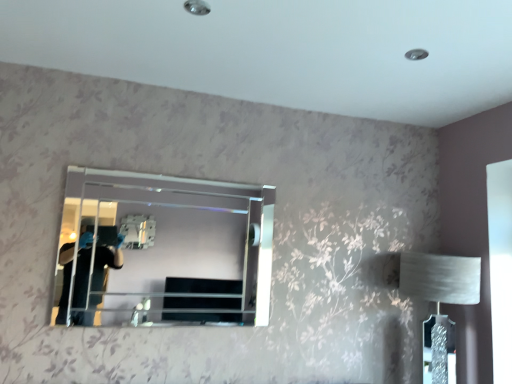
What do you see at coordinates (440, 287) in the screenshot? I see `white fabric lampshade at right` at bounding box center [440, 287].

You are a GUI agent. You are given a task and a screenshot of the screen. Output one action in this format:
    pyautogui.click(x=<x>, y=<y>)
    Task: Click on the white fabric lampshade at right
    The image size is (512, 384).
    Given the screenshot: What is the action you would take?
    pyautogui.click(x=440, y=287)

Where is `clear glass mirror at center`? The height and width of the screenshot is (384, 512). clear glass mirror at center is located at coordinates (164, 250).

The width and height of the screenshot is (512, 384). What do you see at coordinates (164, 250) in the screenshot? I see `clear glass mirror at center` at bounding box center [164, 250].

The height and width of the screenshot is (384, 512). In order to click on white fabric lampshade at right in this screenshot , I will do `click(440, 287)`.

Does clear glass mirror at center appear on the left side of white fabric lampshade at right?

Indeed, clear glass mirror at center is positioned on the left side of white fabric lampshade at right.

Which object is closer to the camera taking this photo, clear glass mirror at center or white fabric lampshade at right?

clear glass mirror at center is in front.

Which point is more forward, (167, 270) or (454, 281)?

The point (167, 270) is more forward.

From the image's perspective, is clear glass mirror at center over white fabric lampshade at right?

Yes, from the image's perspective, clear glass mirror at center is above white fabric lampshade at right.

From a real-world perspective, is clear glass mirror at center positioned above or below white fabric lampshade at right?

Clearly, from a real-world perspective, clear glass mirror at center is above white fabric lampshade at right.

Which of these two, clear glass mirror at center or white fabric lampshade at right, is wider?

white fabric lampshade at right is wider.

Which of these two, clear glass mirror at center or white fabric lampshade at right, stands shorter?

With less height is clear glass mirror at center.

Is clear glass mirror at center smaller than white fabric lampshade at right?

Correct, clear glass mirror at center occupies less space than white fabric lampshade at right.

Is clear glass mirror at center positioned beyond the bounds of white fabric lampshade at right?

Yes, clear glass mirror at center is outside of white fabric lampshade at right.

Is clear glass mirror at center far from white fabric lampshade at right?

Yes, clear glass mirror at center and white fabric lampshade at right are quite far apart.

Is clear glass mirror at center facing away from white fabric lampshade at right?

No.

Measure the distance between clear glass mirror at center and white fabric lampshade at right.

A distance of 3.71 feet exists between clear glass mirror at center and white fabric lampshade at right.

You are a GUI agent. You are given a task and a screenshot of the screen. Output one action in this format:
    pyautogui.click(x=<x>, y=<y>)
    Task: Click on the mirror on the left of the white fabric lampshade at right
    
    Given the screenshot: What is the action you would take?
    pyautogui.click(x=164, y=250)

Looking at this image, considering the positions of objects white fabric lampshade at right and clear glass mirror at center in the image provided, who is more to the left, white fabric lampshade at right or clear glass mirror at center?

Positioned to the left is clear glass mirror at center.

Between white fabric lampshade at right and clear glass mirror at center, which one is positioned behind?

white fabric lampshade at right is further from the camera.

Considering the points (428, 278) and (137, 252), which point is behind, point (428, 278) or point (137, 252)?

Positioned behind is point (428, 278).

From the image's perspective, which is below, white fabric lampshade at right or clear glass mirror at center?

From the image's view, white fabric lampshade at right is below.

From a real-world perspective, which object stands above the other?

From a 3D spatial view, clear glass mirror at center is above.

In the scene shown: Considering the sizes of objects white fabric lampshade at right and clear glass mirror at center in the image provided, who is wider, white fabric lampshade at right or clear glass mirror at center?

With larger width is white fabric lampshade at right.

Who is shorter, white fabric lampshade at right or clear glass mirror at center?

clear glass mirror at center is shorter.

Which of these two, white fabric lampshade at right or clear glass mirror at center, is smaller?

clear glass mirror at center.

Is white fabric lampshade at right situated inside clear glass mirror at center or outside?

white fabric lampshade at right cannot be found inside clear glass mirror at center.

Is white fabric lampshade at right not close to clear glass mirror at center?

Yes, white fabric lampshade at right is far from clear glass mirror at center.

Is white fabric lampshade at right aimed at clear glass mirror at center?

No, white fabric lampshade at right does not turn towards clear glass mirror at center.

Locate an element on the screen. table lamp below the clear glass mirror at center (from the image's perspective) is located at coordinates (440, 287).

At what (x,y) coordinates should I click in order to perform the action: click on table lamp located on the right of clear glass mirror at center. Please return your answer as a coordinate pair (x, y). Looking at the image, I should click on tap(440, 287).

In the image, there is a white fabric lampshade at right. Identify the location of mirror above it (from the image's perspective). (164, 250).